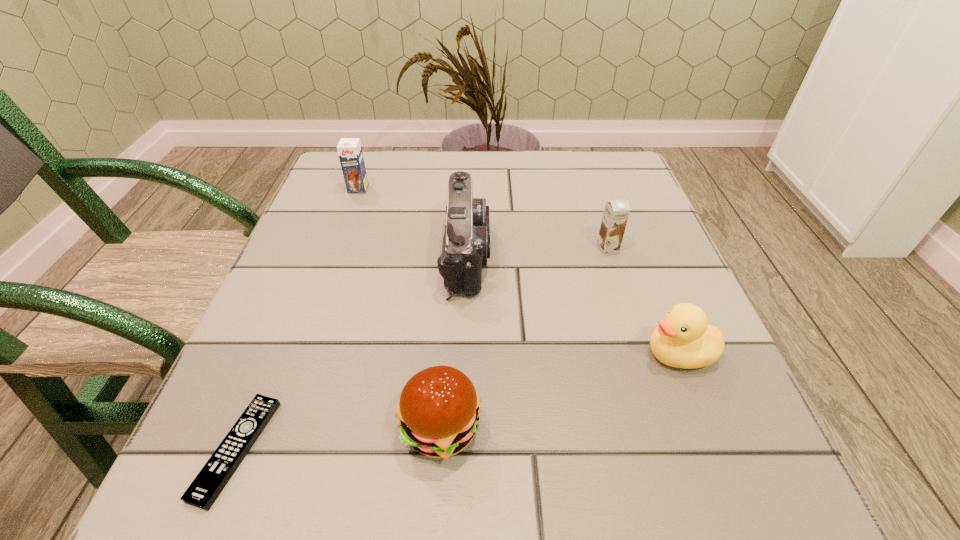
Locate an element on the screen. free space located on the face of the duckling is located at coordinates (485, 354).

Find the location of a particular element. Image resolution: width=960 pixels, height=540 pixels. vacant position located on the face of the duckling is located at coordinates (529, 354).

The width and height of the screenshot is (960, 540). Find the location of `vacant area located on the face of the duckling`. vacant area located on the face of the duckling is located at coordinates (446, 354).

What are the coordinates of `vacant position located 0.200m on the left of the hamburger` in the screenshot? It's located at (254, 428).

Locate an element on the screen. The height and width of the screenshot is (540, 960). blank space located on the right of the remote control is located at coordinates click(453, 449).

At what (x,y) coordinates should I click in order to perform the action: click on object located at the far edge. Please return your answer as a coordinate pair (x, y). Looking at the image, I should click on [x=349, y=150].

Locate an element on the screen. Image resolution: width=960 pixels, height=540 pixels. hamburger at the near edge is located at coordinates (439, 410).

You are a GUI agent. You are given a task and a screenshot of the screen. Output one action in this format:
    pyautogui.click(x=<x>, y=<y>)
    Task: Click on the remote control that is at the near edge
    The height and width of the screenshot is (540, 960).
    Given the screenshot: What is the action you would take?
    pyautogui.click(x=206, y=487)

This screenshot has height=540, width=960. What are the coordinates of `chocolate milk located in the left edge section of the desktop` in the screenshot? It's located at (349, 150).

Identify the location of remote control at the left edge. (206, 487).